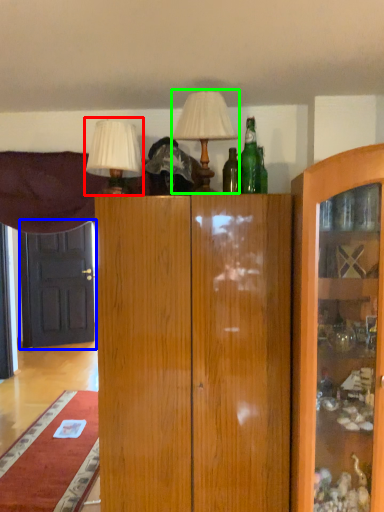
Question: Which object is positioned farthest from table lamp (highlighted by a red box)? Select from door (highlighted by a blue box) and table lamp (highlighted by a green box).

Choices:
 (A) door
 (B) table lamp

Answer: (A)